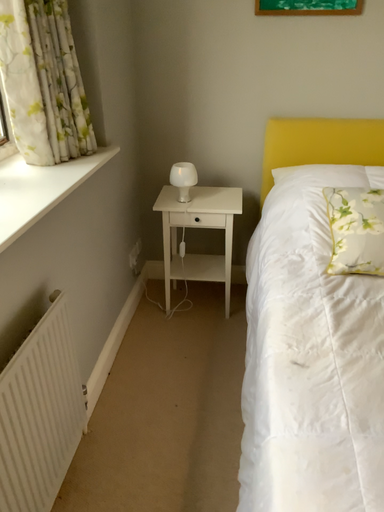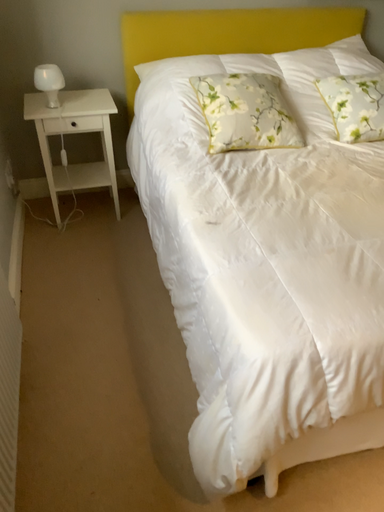
Question: How did the camera likely rotate when shooting the video?

Choices:
 (A) rotated downward
 (B) rotated upward

Answer: (A)